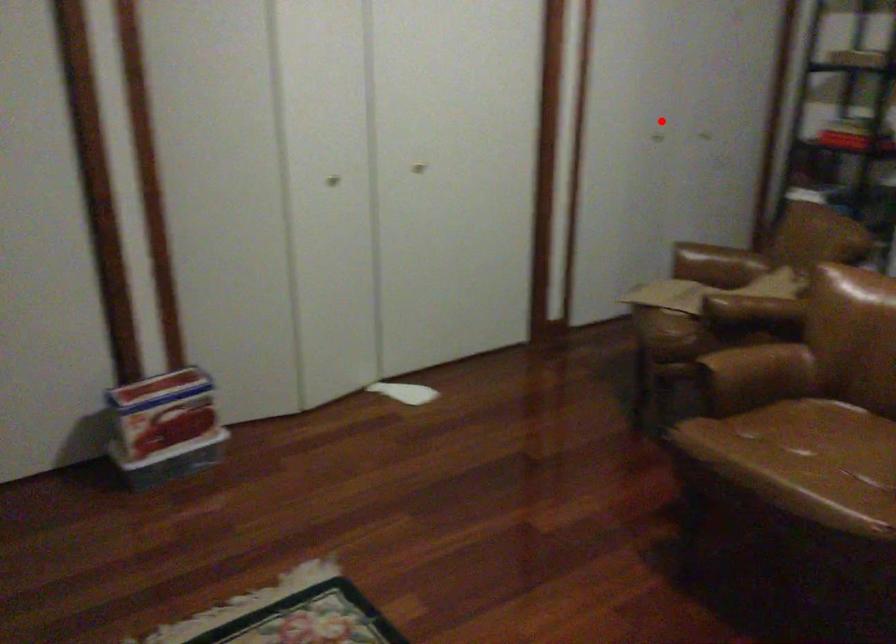
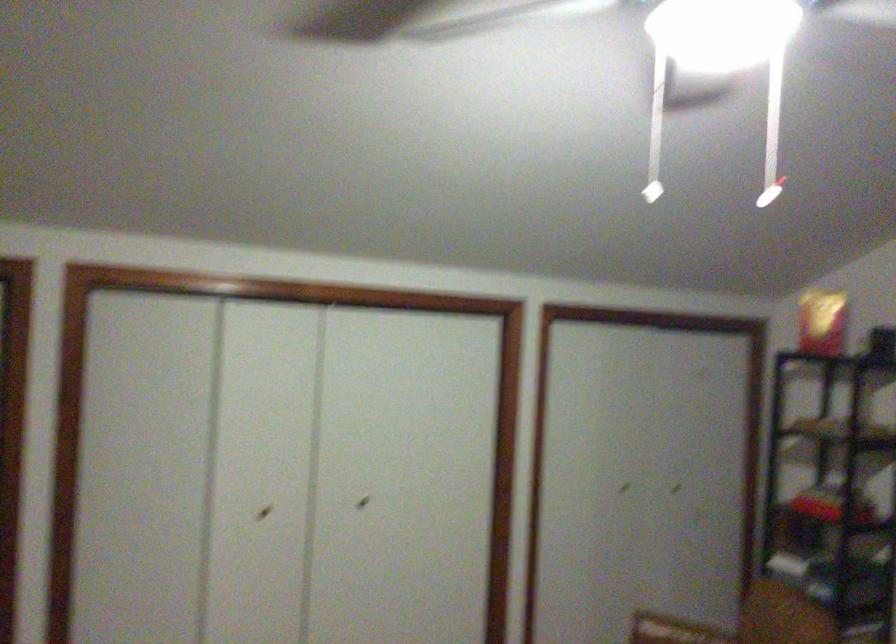
Where in the second image is the point corresponding to the highlighted location from the first image?

(623, 488)